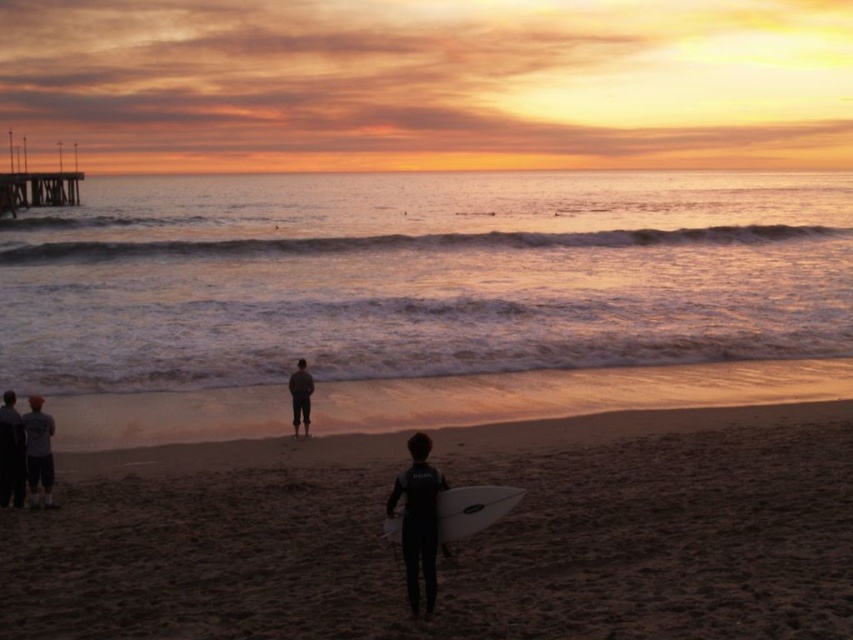
Which is above, brown sandy beach at lower center or dark gray fabric pants at center?

dark gray fabric pants at center is higher up.

Is brown sandy beach at lower center above dark gray fabric pants at center?

Incorrect, brown sandy beach at lower center is not positioned above dark gray fabric pants at center.

Where is `brown sandy beach at lower center`? brown sandy beach at lower center is located at coordinates (460, 545).

Looking at this image, between dark gray fabric shirt at lower left and dark gray wetsuit at lower left, which one is positioned higher?

dark gray wetsuit at lower left is above.

Can you confirm if dark gray fabric shirt at lower left is wider than dark gray wetsuit at lower left?

Correct, the width of dark gray fabric shirt at lower left exceeds that of dark gray wetsuit at lower left.

Does point (42, 445) lie behind point (9, 483)?

No, (42, 445) is closer to viewer.

Identify the location of dark gray fabric shirt at lower left. The width and height of the screenshot is (853, 640). (38, 451).

Does golden reflective water at center come behind dark gray fabric pants at center?

Yes.

In the scene shown: Can you confirm if golden reflective water at center is smaller than dark gray fabric pants at center?

Actually, golden reflective water at center might be larger than dark gray fabric pants at center.

You are a GUI agent. You are given a task and a screenshot of the screen. Output one action in this format:
    pyautogui.click(x=<x>, y=<y>)
    Task: Click on the golden reflective water at center
    This screenshot has height=640, width=853.
    Given the screenshot: What is the action you would take?
    pyautogui.click(x=421, y=276)

What are the coordinates of `golden reflective water at center` in the screenshot? It's located at (421, 276).